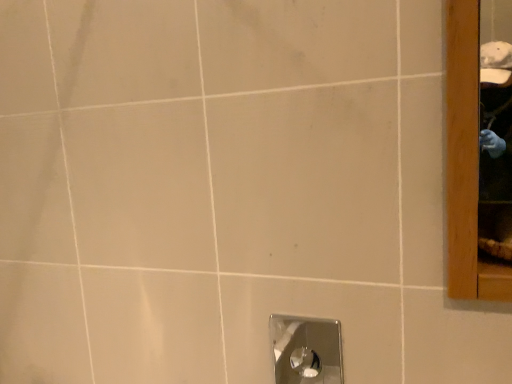
Image resolution: width=512 pixels, height=384 pixels. What do you see at coordinates (306, 350) in the screenshot? I see `satin silver door handle at lower center` at bounding box center [306, 350].

Locate an element on the screen. The height and width of the screenshot is (384, 512). satin silver door handle at lower center is located at coordinates (306, 350).

Where is `satin silver door handle at lower center`? The height and width of the screenshot is (384, 512). satin silver door handle at lower center is located at coordinates (306, 350).